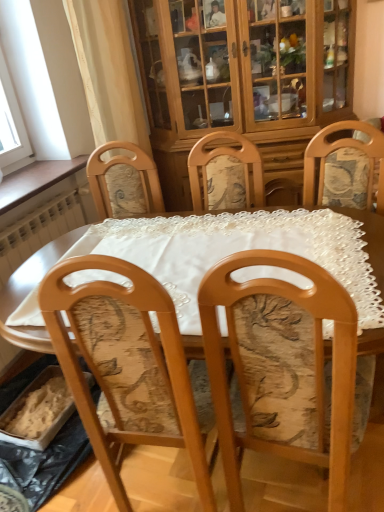
Question: From the image's perspective, is wooden table at center over wooden chair with floral upholstery at center?

Choices:
 (A) no
 (B) yes

Answer: (B)

Question: Are wooden table at center and wooden chair with floral upholstery at center far apart?

Choices:
 (A) yes
 (B) no

Answer: (B)

Question: Can you confirm if wooden table at center is bigger than wooden chair with floral upholstery at center?

Choices:
 (A) no
 (B) yes

Answer: (B)

Question: Is wooden table at center facing towards wooden chair with floral upholstery at center?

Choices:
 (A) yes
 (B) no

Answer: (B)

Question: Does wooden table at center have a greater height compared to wooden chair with floral upholstery at center?

Choices:
 (A) no
 (B) yes

Answer: (A)

Question: Does wooden table at center appear on the right side of wooden chair with floral upholstery at center?

Choices:
 (A) yes
 (B) no

Answer: (B)

Question: From a real-world perspective, is wooden chair with floral upholstery at center beneath wooden cabinet at upper center?

Choices:
 (A) yes
 (B) no

Answer: (A)

Question: Can you confirm if wooden chair with floral upholstery at center is positioned to the left of wooden cabinet at upper center?

Choices:
 (A) yes
 (B) no

Answer: (A)

Question: Is wooden chair with floral upholstery at center smaller than wooden cabinet at upper center?

Choices:
 (A) no
 (B) yes

Answer: (B)

Question: Is wooden chair with floral upholstery at center with wooden cabinet at upper center?

Choices:
 (A) no
 (B) yes

Answer: (A)

Question: Is wooden chair with floral upholstery at center behind wooden cabinet at upper center?

Choices:
 (A) yes
 (B) no

Answer: (B)

Question: Is wooden chair with floral upholstery at center shorter than wooden cabinet at upper center?

Choices:
 (A) yes
 (B) no

Answer: (A)

Question: From a real-world perspective, is wooden cabinet at upper center beneath wooden table at center?

Choices:
 (A) yes
 (B) no

Answer: (B)